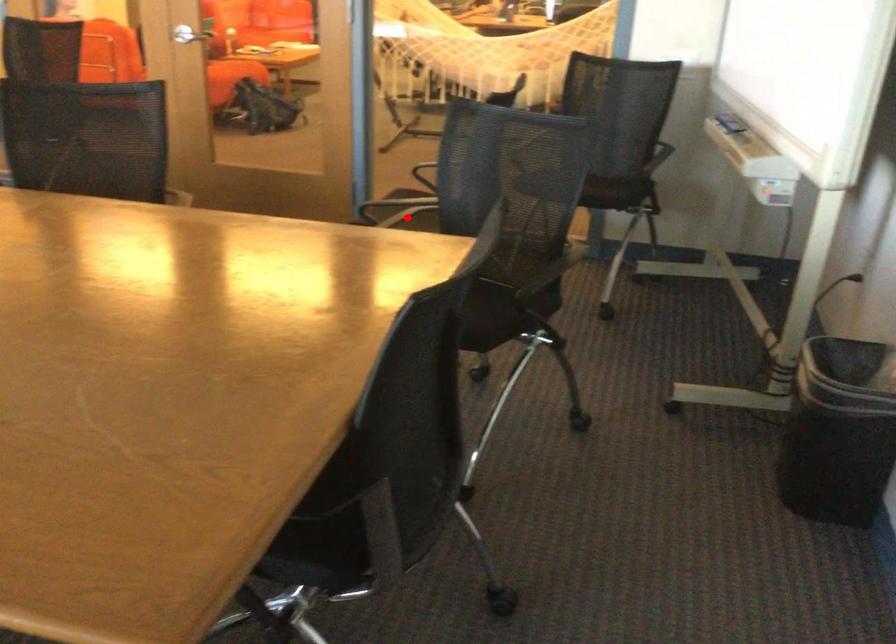
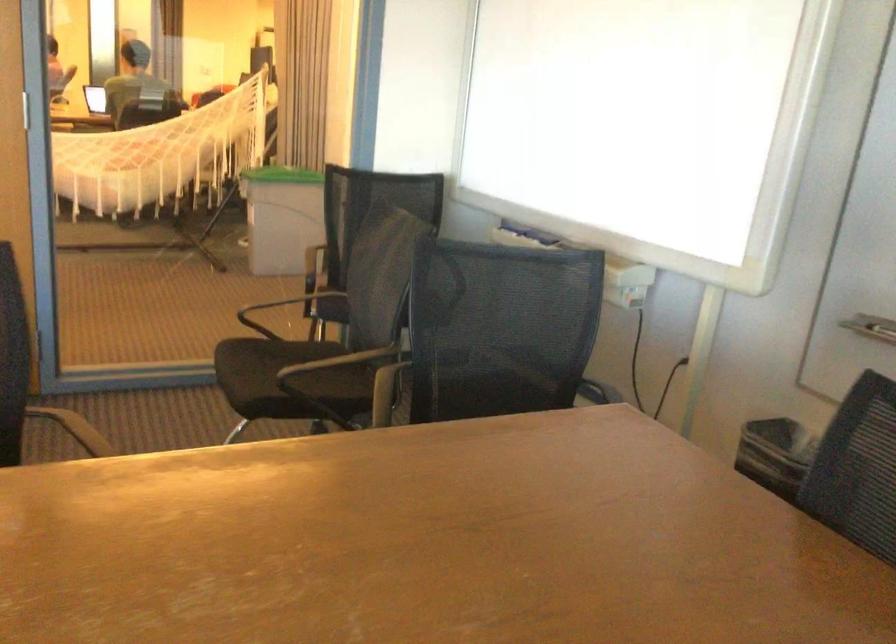
Where in the second image is the point corresponding to the highlighted location from the first image?

(288, 379)